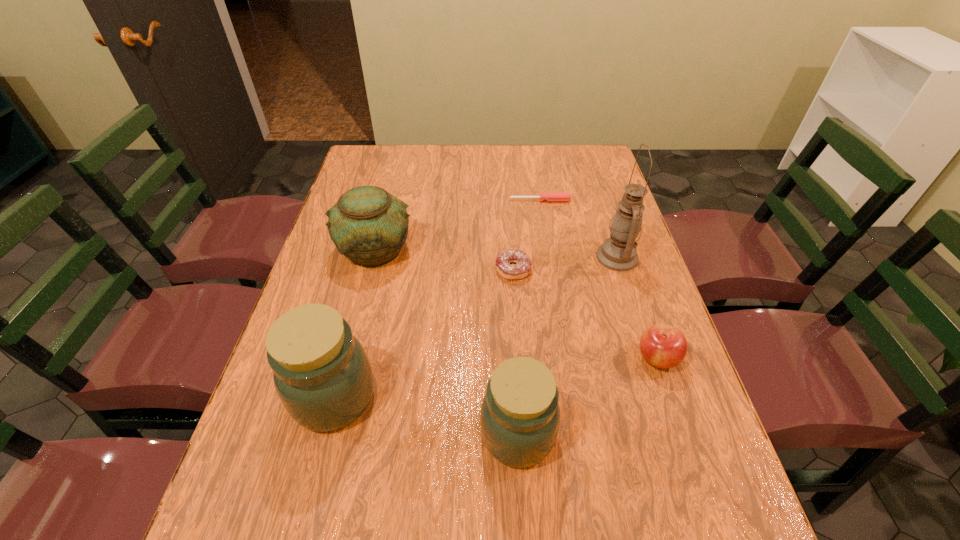
Please show where to add a jar on the right while keeping spacing even. Please provide its 2D coordinates. Your answer should be formatted as a tuple, i.e. [(x, y)], where the tuple contains the x and y coordinates of a point satisfying the conditions above.

[(728, 477)]